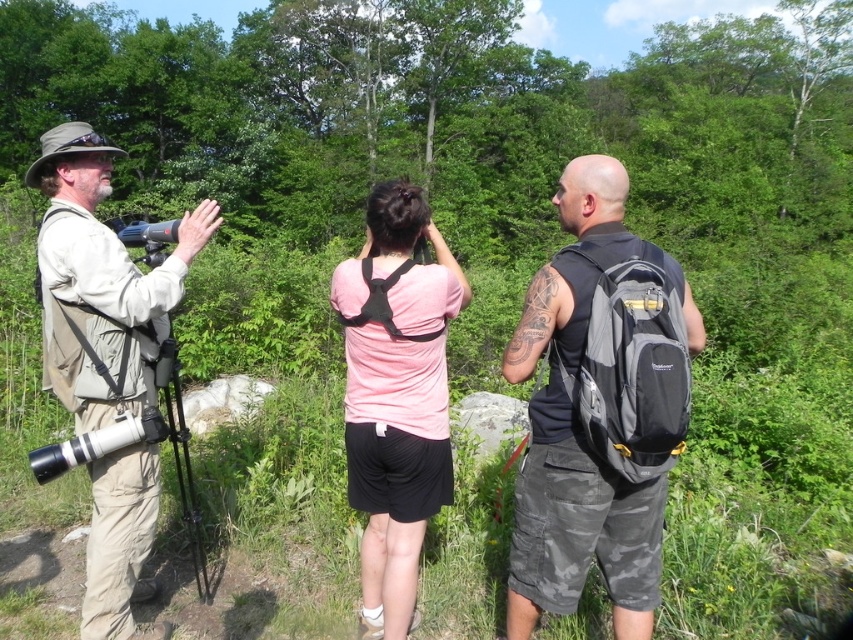
You are a photographer trying to capture a clear shot of the pink fabric shirt at center and the black fabric backpack at center. Which object should you focus on first if you want to ensure both are in focus without adjusting your camera settings?

The pink fabric shirt at center is located above the black fabric backpack at center, so focusing on the pink fabric shirt at center first would ensure both are in focus since it is closer to the camera.

You are a hiker who wants to take a photo of the two people in the scene. The khaki fabric shirt at left and the pink fabric shirt at center are both in your viewfinder. According to the scene description, which shirt is positioned higher in the frame?

The khaki fabric shirt at left is located above the pink fabric shirt at center, so it is positioned higher in the frame.

You are a photographer who wants to take a picture of the two people in the scene. The khaki fabric shirt at left and the pink fabric shirt at center are important subjects. Based on their positions, which shirt should you focus on first if you want to capture both in a single frame without moving the camera?

Since the khaki fabric shirt at left is to the left of the pink fabric shirt at center, you should focus on the khaki fabric shirt at left first as it is positioned further left, allowing both subjects to be captured in the frame when centered appropriately.